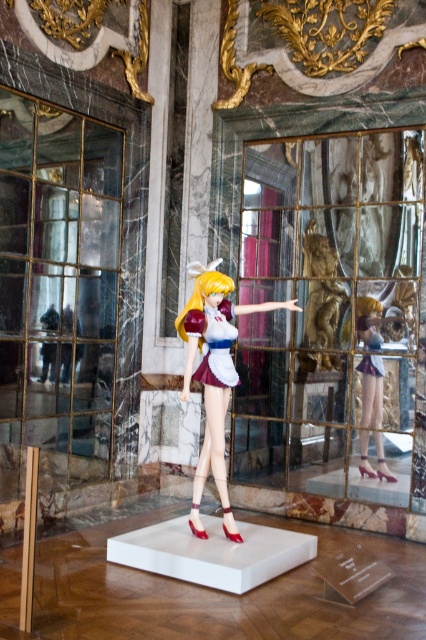
Question: In this image, where is satin white dress at center located relative to golden hair at center?

Choices:
 (A) left
 (B) right

Answer: (B)

Question: Can you confirm if gold metallic statue at center is wider than satin white dress at center?

Choices:
 (A) no
 (B) yes

Answer: (A)

Question: Which object is closer to the camera taking this photo?

Choices:
 (A) satin gold doll at center
 (B) satin white dress at center
 (C) clear glass display case at center

Answer: (A)

Question: Which point appears closest to the camera in this image?

Choices:
 (A) (388, 317)
 (B) (328, 291)

Answer: (A)

Question: Does clear glass display case at center have a greater width compared to gold metallic statue at center?

Choices:
 (A) no
 (B) yes

Answer: (B)

Question: Estimate the real-world distances between objects in this image. Which object is farther from the gold metallic statue at center?

Choices:
 (A) matte plastic doll at center
 (B) satin white dress at center
 (C) satin gold doll at center
 (D) clear glass display case at center

Answer: (B)